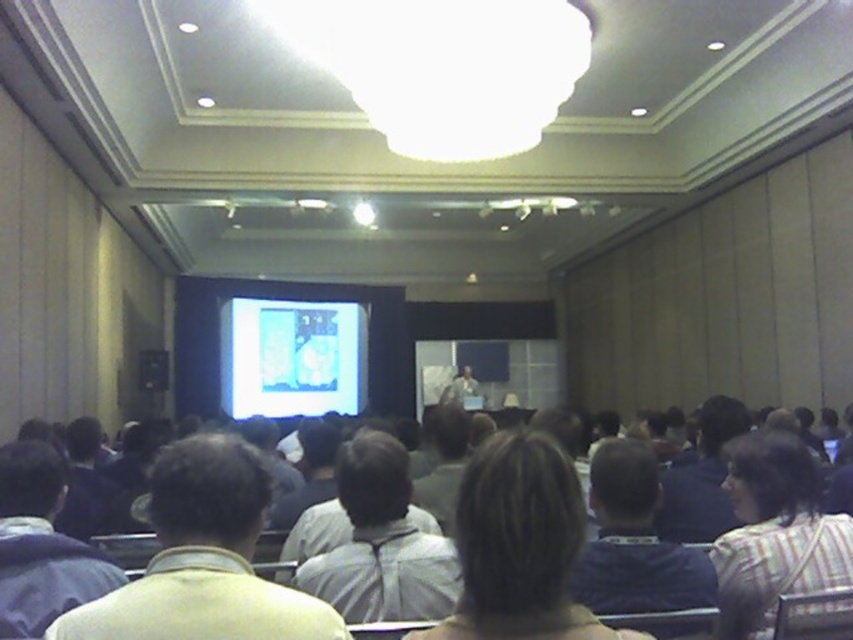
The image size is (853, 640). What do you see at coordinates (41, 545) in the screenshot?
I see `light gray shirt at lower left` at bounding box center [41, 545].

Who is lower down, light gray shirt at lower left or light blue shirt at center?

light blue shirt at center

Is point (74, 596) farther from viewer compared to point (451, 394)?

No, (74, 596) is in front of (451, 394).

This screenshot has width=853, height=640. What are the coordinates of `light gray shirt at lower left` in the screenshot? It's located at (41, 545).

Is point (506, 628) positioned in front of point (473, 385)?

That is True.

Locate an element on the screen. The image size is (853, 640). brown hair at center is located at coordinates (519, 545).

Where is `brown hair at center`? brown hair at center is located at coordinates (519, 545).

Is light gray shirt at center taller than light blue shirt at center?

In fact, light gray shirt at center may be shorter than light blue shirt at center.

Consider the image. Between light gray shirt at center and light blue shirt at center, which one is positioned higher?

Positioned higher is light gray shirt at center.

Where is `light gray shirt at center`? This screenshot has height=640, width=853. light gray shirt at center is located at coordinates (635, 541).